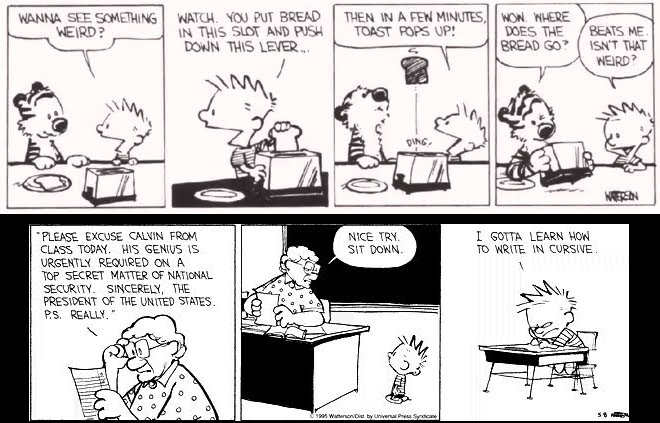
Image resolution: width=660 pixels, height=423 pixels. I want to click on plate, so click(x=30, y=186), click(x=224, y=197), click(x=354, y=186), click(x=528, y=187).